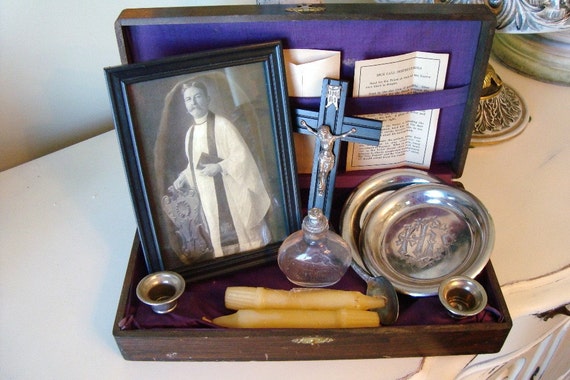
Identify the location of spoon. This screenshot has width=570, height=380. (388, 285).